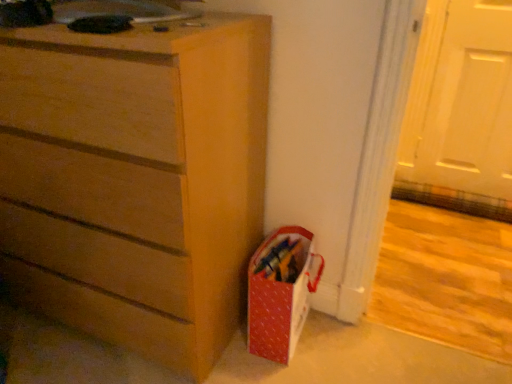
Measure the distance between white matte door at upper right and camera.

A distance of 1.85 meters exists between white matte door at upper right and camera.

At what (x,y) coordinates should I click in order to perform the action: click on matte red gift bag at lower right. Please return your answer as a coordinate pair (x, y). Looking at the image, I should click on (281, 292).

Which object is more forward, matte red gift bag at lower right or matte wood chest of drawers at center?

matte wood chest of drawers at center is closer to the camera.

Which of these two, matte red gift bag at lower right or matte wood chest of drawers at center, is thinner?

Thinner between the two is matte red gift bag at lower right.

Based on the photo, considering the sizes of white matte door at upper right and matte red gift bag at lower right in the image, is white matte door at upper right wider or thinner than matte red gift bag at lower right?

Considering their sizes, white matte door at upper right looks slimmer than matte red gift bag at lower right.

Is point (478, 182) in front of point (312, 280)?

No, (478, 182) is further to viewer.

Considering the relative positions of white matte door at upper right and matte red gift bag at lower right in the image provided, is white matte door at upper right to the left of matte red gift bag at lower right from the viewer's perspective?

No.

In terms of height, does white matte door at upper right look taller or shorter compared to matte red gift bag at lower right?

In the image, white matte door at upper right appears to be taller than matte red gift bag at lower right.

Considering the sizes of objects matte wood chest of drawers at center and matte red gift bag at lower right in the image provided, who is shorter, matte wood chest of drawers at center or matte red gift bag at lower right?

matte red gift bag at lower right.

Which object is further away from the camera taking this photo, matte wood chest of drawers at center or matte red gift bag at lower right?

matte red gift bag at lower right is further away from the camera.

Which of these two, matte wood chest of drawers at center or matte red gift bag at lower right, is smaller?

matte red gift bag at lower right.

Between matte wood chest of drawers at center and matte red gift bag at lower right, which one has smaller width?

matte red gift bag at lower right is thinner.

Is matte red gift bag at lower right bigger or smaller than white matte door at upper right?

matte red gift bag at lower right is smaller than white matte door at upper right.

Is matte red gift bag at lower right inside or outside of white matte door at upper right?

matte red gift bag at lower right is not inside white matte door at upper right, it's outside.

Which is more to the right, matte red gift bag at lower right or white matte door at upper right?

Positioned to the right is white matte door at upper right.

Which object is further away from the camera taking this photo, white matte door at upper right or matte wood chest of drawers at center?

Positioned behind is white matte door at upper right.

Which object is thinner, white matte door at upper right or matte wood chest of drawers at center?

white matte door at upper right is thinner.

Does white matte door at upper right have a greater height compared to matte wood chest of drawers at center?

In fact, white matte door at upper right may be shorter than matte wood chest of drawers at center.

Considering the sizes of matte wood chest of drawers at center and white matte door at upper right in the image, is matte wood chest of drawers at center taller or shorter than white matte door at upper right?

Considering their sizes, matte wood chest of drawers at center has more height than white matte door at upper right.

Is matte wood chest of drawers at center inside the boundaries of white matte door at upper right, or outside?

matte wood chest of drawers at center is located beyond the bounds of white matte door at upper right.

From the image's perspective, is matte wood chest of drawers at center located beneath white matte door at upper right?

Correct, matte wood chest of drawers at center appears lower than white matte door at upper right in the image.

This screenshot has width=512, height=384. Find the location of `chest of drawers on the left of the white matte door at upper right`. chest of drawers on the left of the white matte door at upper right is located at coordinates (136, 179).

Where is `gift bag below the matte wood chest of drawers at center (from the image's perspective)`? This screenshot has width=512, height=384. gift bag below the matte wood chest of drawers at center (from the image's perspective) is located at coordinates (281, 292).

Locate an element on the screen. This screenshot has height=384, width=512. screen door behind the matte red gift bag at lower right is located at coordinates (461, 100).

Based on their spatial positions, is matte red gift bag at lower right or matte wood chest of drawers at center closer to white matte door at upper right?

Based on the image, matte red gift bag at lower right appears to be nearer to white matte door at upper right.

Considering their positions, is white matte door at upper right positioned further to matte wood chest of drawers at center than matte red gift bag at lower right?

Among the two, white matte door at upper right is located further to matte wood chest of drawers at center.

From the image, which object appears to be farther from matte wood chest of drawers at center, matte red gift bag at lower right or white matte door at upper right?

white matte door at upper right is further to matte wood chest of drawers at center.

From the image, which object appears to be farther from matte red gift bag at lower right, white matte door at upper right or matte wood chest of drawers at center?

white matte door at upper right is further to matte red gift bag at lower right.

Estimate the real-world distances between objects in this image. Which object is closer to white matte door at upper right, matte wood chest of drawers at center or matte red gift bag at lower right?

matte red gift bag at lower right is closer to white matte door at upper right.

Looking at the image, which one is located closer to matte red gift bag at lower right, matte wood chest of drawers at center or white matte door at upper right?

matte wood chest of drawers at center is positioned closer to the anchor matte red gift bag at lower right.

The height and width of the screenshot is (384, 512). I want to click on gift bag between matte wood chest of drawers at center and white matte door at upper right, so click(281, 292).